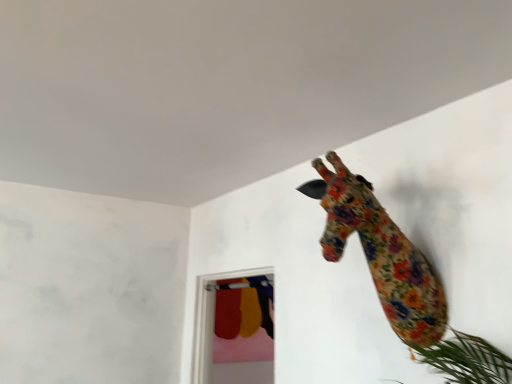
Looking at this image, measure the distance between point (270, 291) and camera.

Point (270, 291) is 4.02 meters from camera.

The width and height of the screenshot is (512, 384). Identify the location of transparent glass door at center. (234, 328).

What do you see at coordinates (234, 328) in the screenshot?
I see `transparent glass door at center` at bounding box center [234, 328].

Where is `floral fabric giraffe at upper right`? floral fabric giraffe at upper right is located at coordinates (380, 253).

This screenshot has height=384, width=512. What do you see at coordinates (380, 253) in the screenshot?
I see `floral fabric giraffe at upper right` at bounding box center [380, 253].

Where is `transparent glass door at center`? transparent glass door at center is located at coordinates (234, 328).

Which is more to the left, transparent glass door at center or floral fabric giraffe at upper right?

From the viewer's perspective, transparent glass door at center appears more on the left side.

Looking at this image, is the depth of transparent glass door at center greater than that of floral fabric giraffe at upper right?

Yes, transparent glass door at center is behind floral fabric giraffe at upper right.

Considering the positions of point (241, 343) and point (409, 294), is point (241, 343) closer or farther from the camera than point (409, 294)?

Point (241, 343).

From the image's perspective, is transparent glass door at center located beneath floral fabric giraffe at upper right?

Yes.

From a real-world perspective, is transparent glass door at center physically located above or below floral fabric giraffe at upper right?

In terms of real-world spatial position, transparent glass door at center is below floral fabric giraffe at upper right.

Which of these two, transparent glass door at center or floral fabric giraffe at upper right, is thinner?

With smaller width is transparent glass door at center.

Is transparent glass door at center taller or shorter than floral fabric giraffe at upper right?

transparent glass door at center is taller than floral fabric giraffe at upper right.

Consider the image. Which of these two, transparent glass door at center or floral fabric giraffe at upper right, is bigger?

transparent glass door at center is bigger.

Is transparent glass door at center inside or outside of floral fabric giraffe at upper right?

transparent glass door at center is spatially situated outside floral fabric giraffe at upper right.

Is transparent glass door at center beside floral fabric giraffe at upper right?

No, transparent glass door at center is not making contact with floral fabric giraffe at upper right.

Is transparent glass door at center aimed at floral fabric giraffe at upper right?

No, transparent glass door at center is not aimed at floral fabric giraffe at upper right.

What's the angular difference between transparent glass door at center and floral fabric giraffe at upper right's facing directions?

0.235 degrees.

Identify the location of glass door below the floral fabric giraffe at upper right (from the image's perspective). (234, 328).

Is floral fabric giraffe at upper right to the left of transparent glass door at center from the viewer's perspective?

Incorrect, floral fabric giraffe at upper right is not on the left side of transparent glass door at center.

Relative to transparent glass door at center, is floral fabric giraffe at upper right in front or behind?

Visually, floral fabric giraffe at upper right is located in front of transparent glass door at center.

Based on the photo, which point is more distant from viewer, (366, 209) or (215, 311)?

The point (215, 311) is farther from the camera.

From the image's perspective, which object appears higher, floral fabric giraffe at upper right or transparent glass door at center?

From the image's view, floral fabric giraffe at upper right is above.

From a real-world perspective, is floral fabric giraffe at upper right physically located above or below transparent glass door at center?

Clearly, from a real-world perspective, floral fabric giraffe at upper right is above transparent glass door at center.

Considering the sizes of objects floral fabric giraffe at upper right and transparent glass door at center in the image provided, who is wider, floral fabric giraffe at upper right or transparent glass door at center?

floral fabric giraffe at upper right is wider.

Does floral fabric giraffe at upper right have a greater height compared to transparent glass door at center?

In fact, floral fabric giraffe at upper right may be shorter than transparent glass door at center.

Looking at the image, does floral fabric giraffe at upper right seem bigger or smaller compared to transparent glass door at center?

floral fabric giraffe at upper right is smaller than transparent glass door at center.

Is floral fabric giraffe at upper right not within transparent glass door at center?

Yes, floral fabric giraffe at upper right is not within transparent glass door at center.

In the scene shown: Is floral fabric giraffe at upper right directly adjacent to transparent glass door at center?

No, floral fabric giraffe at upper right is not touching transparent glass door at center.

Could you tell me if floral fabric giraffe at upper right is turned towards transparent glass door at center?

No, floral fabric giraffe at upper right is not aimed at transparent glass door at center.

Find the location of `giraffe that appears above the transparent glass door at center (from the image's perspective)`. giraffe that appears above the transparent glass door at center (from the image's perspective) is located at coordinates (380, 253).

Where is `glass door behind the floral fabric giraffe at upper right`? The width and height of the screenshot is (512, 384). glass door behind the floral fabric giraffe at upper right is located at coordinates (x=234, y=328).

This screenshot has height=384, width=512. In order to click on glass door on the left of the floral fabric giraffe at upper right in this screenshot , I will do `click(234, 328)`.